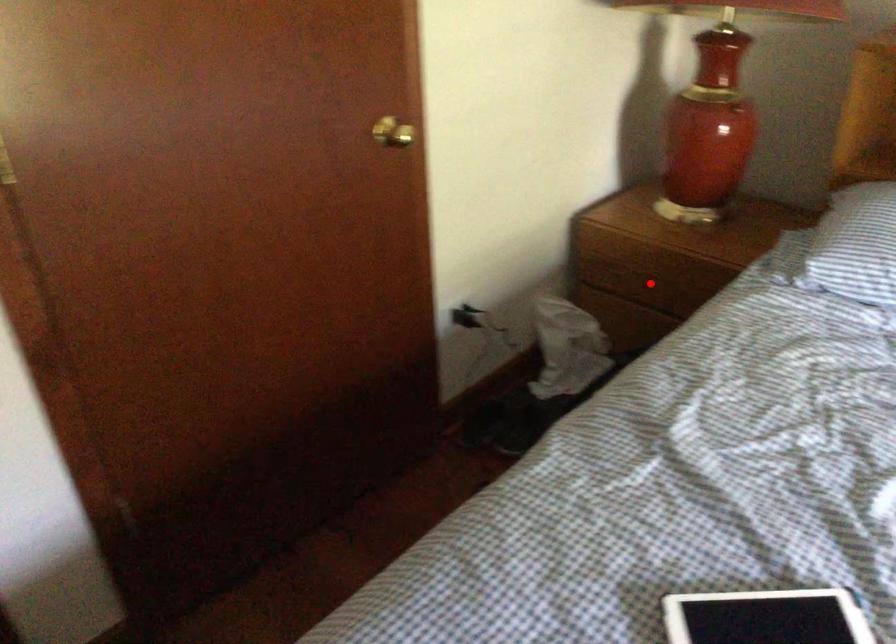
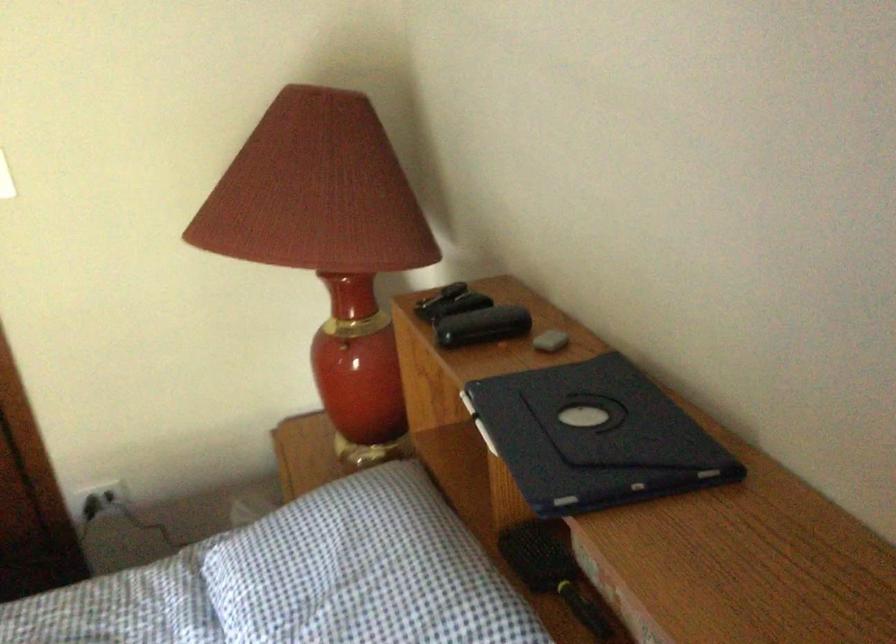
Question: I am providing you with two images of the same scene from different viewpoints. A red point is marked on the first image. Can you still see the location of the red point in image 2?

Choices:
 (A) Yes
 (B) No

Answer: (B)